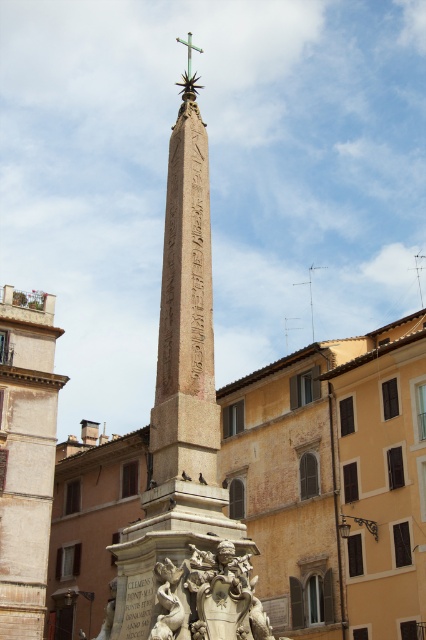
Between beige stone obelisk at center and light brown stone tower at left, which one has more height?

Standing taller between the two is beige stone obelisk at center.

Does beige stone obelisk at center appear on the right side of light brown stone tower at left?

Correct, you'll find beige stone obelisk at center to the right of light brown stone tower at left.

Identify the location of beige stone obelisk at center. The image size is (426, 640). (186, 436).

Is polished stone sculpture at center positioned at the back of green metallic cross at upper center?

That is False.

Who is shorter, polished stone sculpture at center or green metallic cross at upper center?

With less height is polished stone sculpture at center.

Locate an element on the screen. The image size is (426, 640). polished stone sculpture at center is located at coordinates (210, 596).

Who is shorter, light brown stone tower at left or green metallic cross at upper center?

light brown stone tower at left

Which is above, light brown stone tower at left or green metallic cross at upper center?

green metallic cross at upper center is above.

Is point (40, 300) less distant than point (183, 42)?

That is True.

The height and width of the screenshot is (640, 426). Identify the location of light brown stone tower at left. (25, 456).